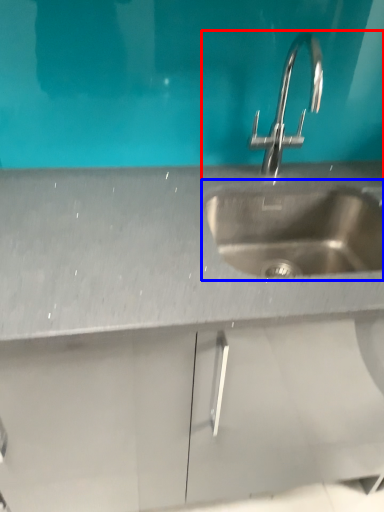
Question: Among these objects, which one is farthest to the camera, sink (highlighted by a red box) or sink (highlighted by a blue box)?

Choices:
 (A) sink
 (B) sink

Answer: (B)